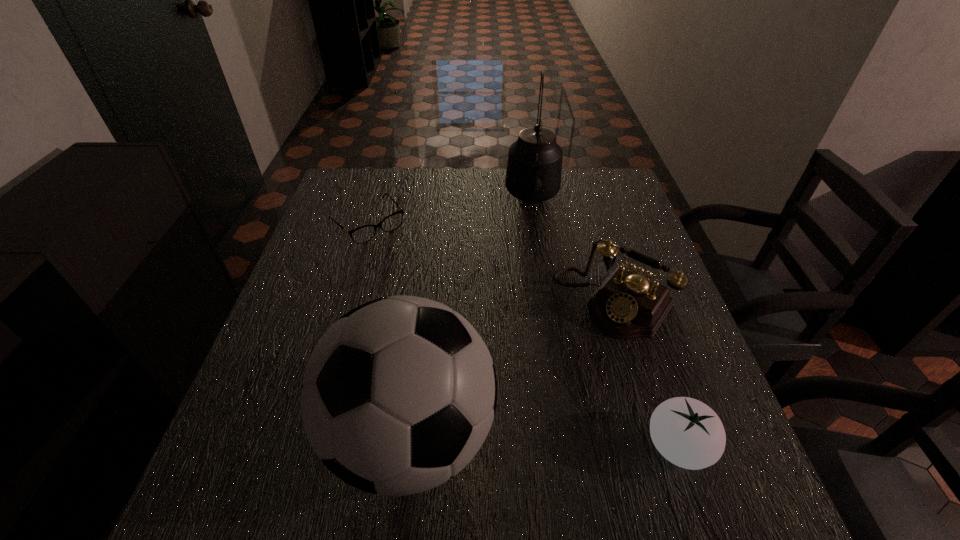
Locate an element on the screen. This screenshot has width=960, height=540. vacant space on the desktop that is between the fourth shortest object and the tomato and is positioned on the dial of the third tallest object is located at coordinates (507, 439).

Locate an element on the screen. The height and width of the screenshot is (540, 960). free space on the desktop that is between the soccer ball and the second shortest object and is positioned spout on the tallest object is located at coordinates (528, 440).

Where is `free space on the desktop that is between the soccer ball and the tomato and is positioned on the front-facing side of the shortest object`? This screenshot has height=540, width=960. free space on the desktop that is between the soccer ball and the tomato and is positioned on the front-facing side of the shortest object is located at coordinates (578, 442).